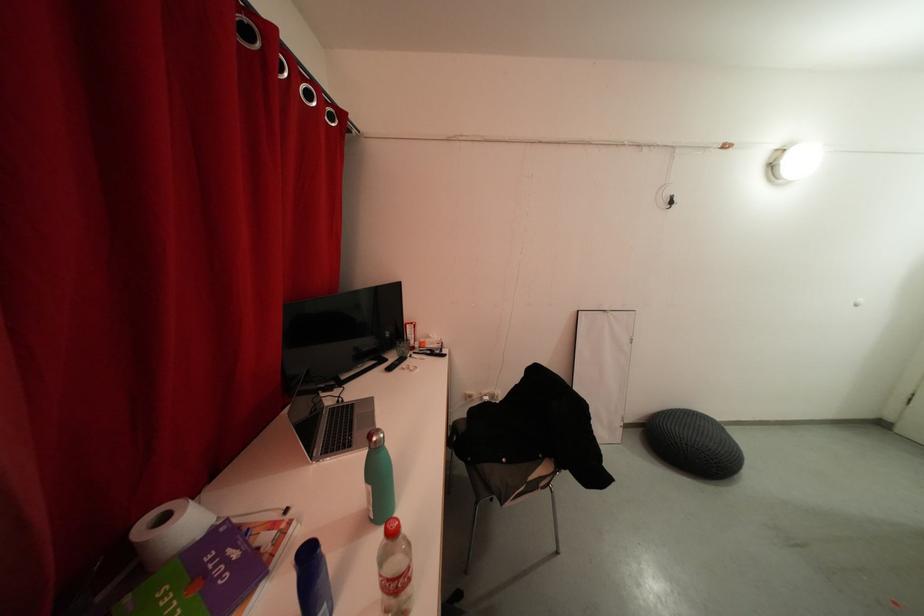
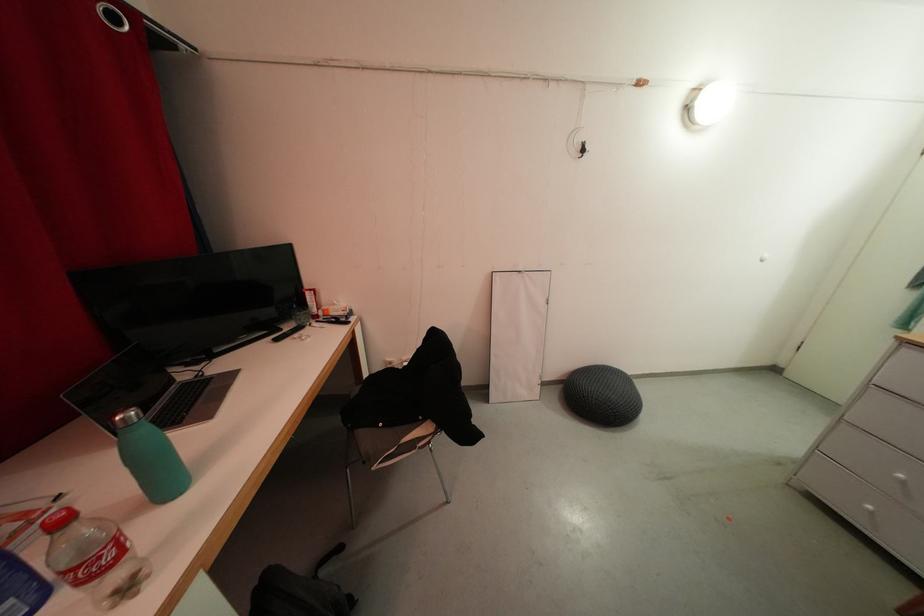
Find the pixel in the second image that matches [646,434] in the first image.

(565, 390)